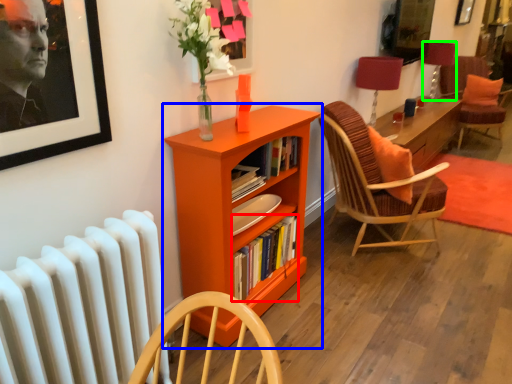
Question: Which object is the farthest from book (highlighted by a red box)? Choose among these: bookcase (highlighted by a blue box) or table lamp (highlighted by a green box).

Choices:
 (A) bookcase
 (B) table lamp

Answer: (B)